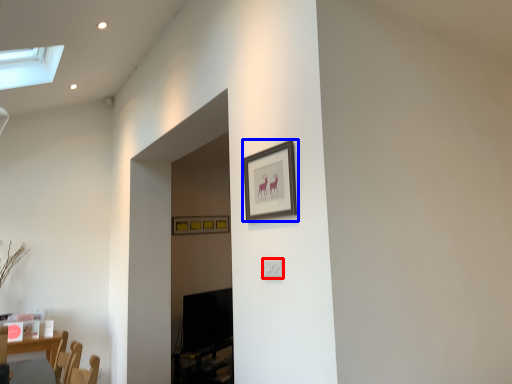
Question: Among these objects, which one is nearest to the camera, electric outlet (highlighted by a red box) or picture frame (highlighted by a blue box)?

Choices:
 (A) electric outlet
 (B) picture frame

Answer: (B)